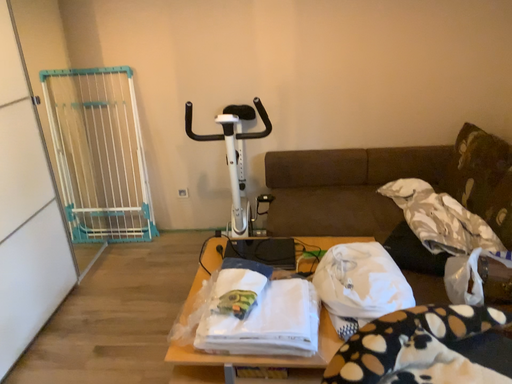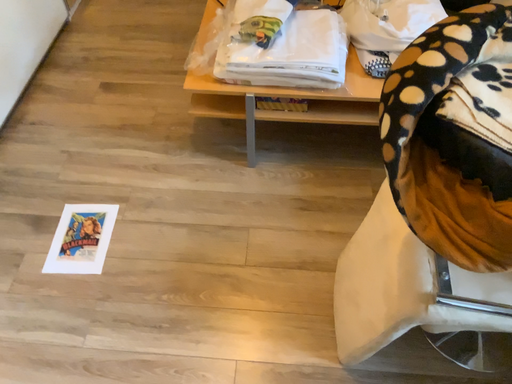
Question: Which way did the camera rotate in the video?

Choices:
 (A) rotated downward
 (B) rotated upward

Answer: (A)